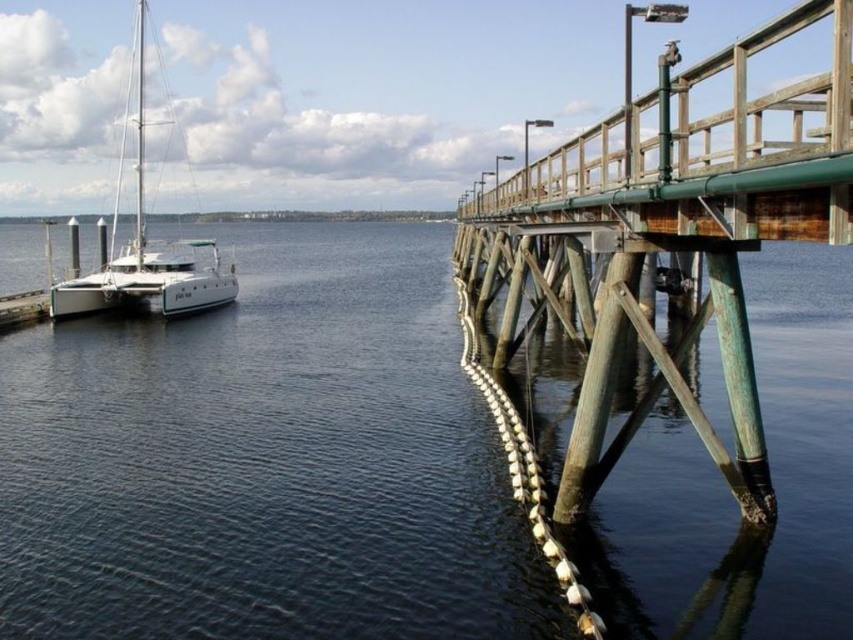
Is transparent blue water at center to the right of white matte sailboat at left from the viewer's perspective?

Indeed, transparent blue water at center is positioned on the right side of white matte sailboat at left.

Is transparent blue water at center closer to the viewer compared to white matte sailboat at left?

Yes, it is.

You are a GUI agent. You are given a task and a screenshot of the screen. Output one action in this format:
    pyautogui.click(x=<x>, y=<y>)
    Task: Click on the transparent blue water at center
    This screenshot has height=640, width=853.
    Given the screenshot: What is the action you would take?
    (265, 460)

Locate an element on the screen. The height and width of the screenshot is (640, 853). transparent blue water at center is located at coordinates (265, 460).

From the picture: Between green wooden pier at upper center and white matte sailboat at left, which one appears on the left side from the viewer's perspective?

white matte sailboat at left is more to the left.

Between point (795, 179) and point (206, 280), which one is positioned in front?

Point (795, 179) is more forward.

Locate an element on the screen. This screenshot has width=853, height=640. green wooden pier at upper center is located at coordinates (672, 230).

Who is shorter, transparent blue water at center or green wooden pier at upper center?

With less height is transparent blue water at center.

Can you confirm if transparent blue water at center is shorter than green wooden pier at upper center?

Yes.

At what (x,y) coordinates should I click in order to perform the action: click on transparent blue water at center. Please return your answer as a coordinate pair (x, y). The image size is (853, 640). Looking at the image, I should click on (265, 460).

Where is `transparent blue water at center`? transparent blue water at center is located at coordinates tap(265, 460).